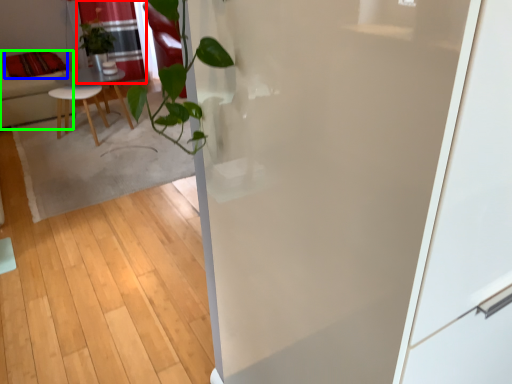
Question: Based on their relative distances, which object is nearer to curtain (highlighted by a red box)? Choose from pillow (highlighted by a blue box) and furniture (highlighted by a green box).

Choices:
 (A) pillow
 (B) furniture

Answer: (A)